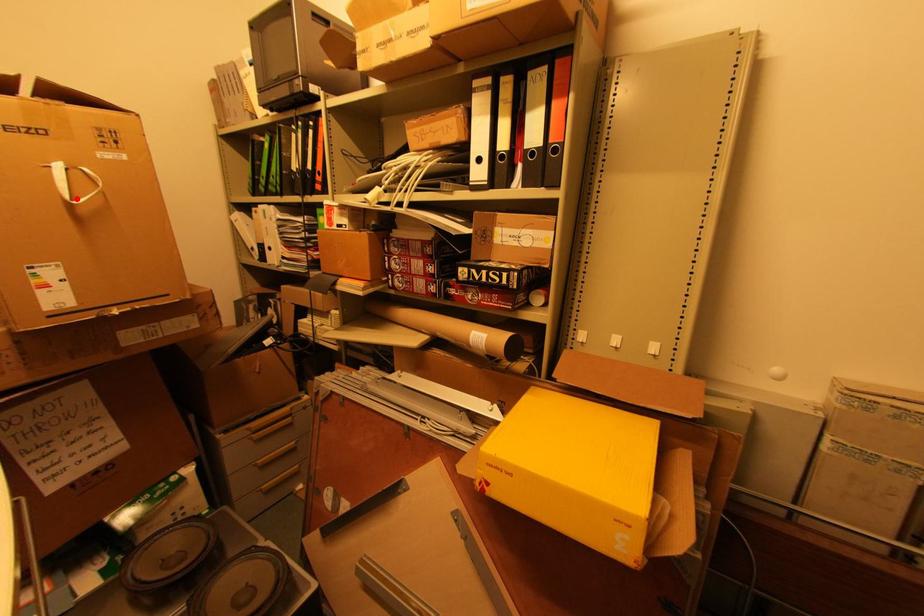
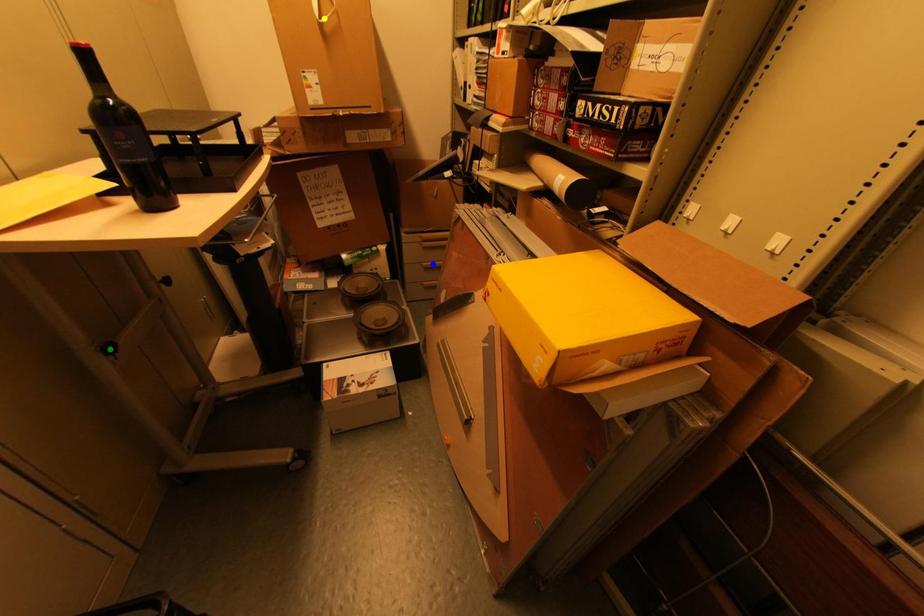
Question: I am providing you with two images of the same scene from different viewpoints. A red point is marked on the first image. You are given multiple points on the second image. In image 2, which mark is for the same physical point as the one in image 1?

Choices:
 (A) green point
 (B) yellow point
 (C) blue point

Answer: (B)